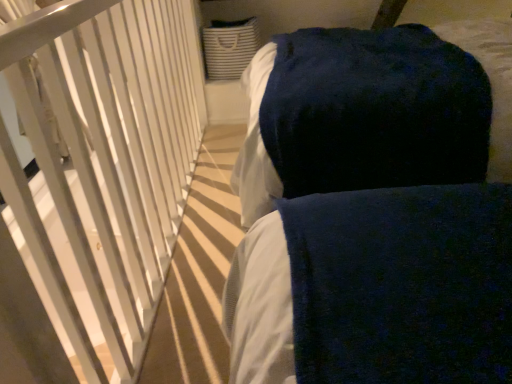
Question: Should I look upward or downward to see white matte railing at left?

Choices:
 (A) down
 (B) up

Answer: (B)